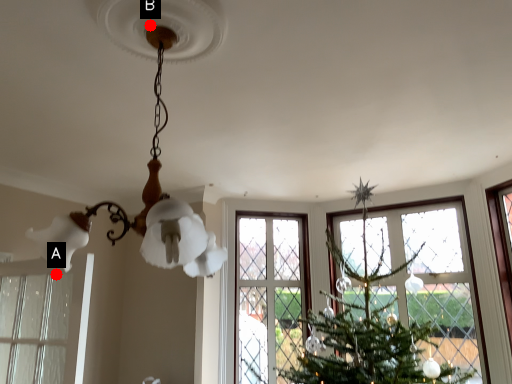
Question: Two points are circled on the image, labeled by A and B beside each circle. Among these points, which one is farthest from the camera?

Choices:
 (A) A is further
 (B) B is further

Answer: (A)